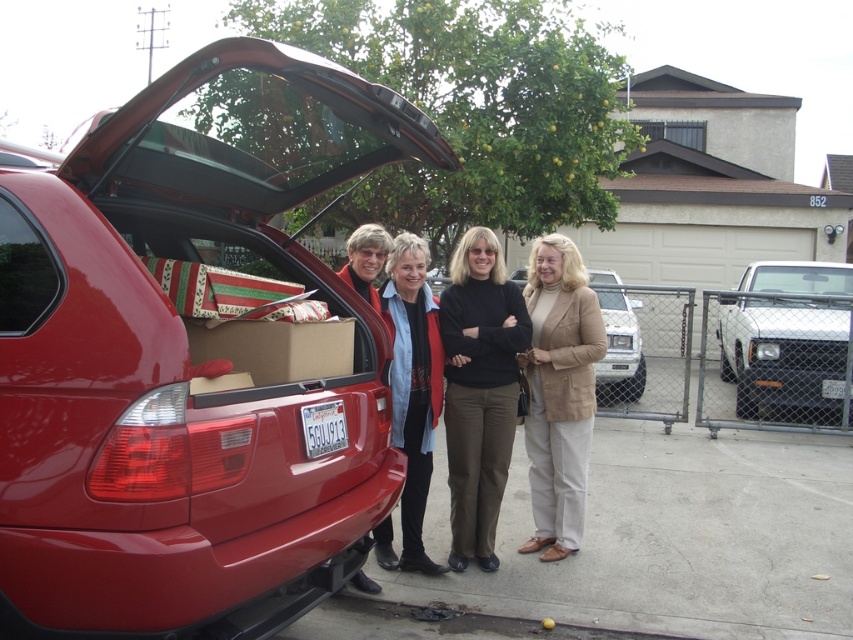
Is point (776, 264) closer to viewer compared to point (432, 438)?

That is False.

This screenshot has height=640, width=853. Identify the location of black glossy truck at right. (787, 339).

Locate an element on the screen. The height and width of the screenshot is (640, 853). black glossy truck at right is located at coordinates (787, 339).

The height and width of the screenshot is (640, 853). What do you see at coordinates (560, 392) in the screenshot? I see `beige fabric jacket at center` at bounding box center [560, 392].

Consider the image. Can you confirm if beige fabric jacket at center is bigger than matte red jacket at center?

No.

The height and width of the screenshot is (640, 853). In order to click on beige fabric jacket at center in this screenshot , I will do `click(560, 392)`.

Is point (579, 419) positioned after point (640, 356)?

No.

Is point (544, 545) farther from camera compared to point (608, 342)?

No.

You are a GUI agent. You are given a task and a screenshot of the screen. Output one action in this format:
    pyautogui.click(x=<x>, y=<y>)
    Task: Click on the beige fabric jacket at center
    This screenshot has height=640, width=853.
    Given the screenshot: What is the action you would take?
    pyautogui.click(x=560, y=392)